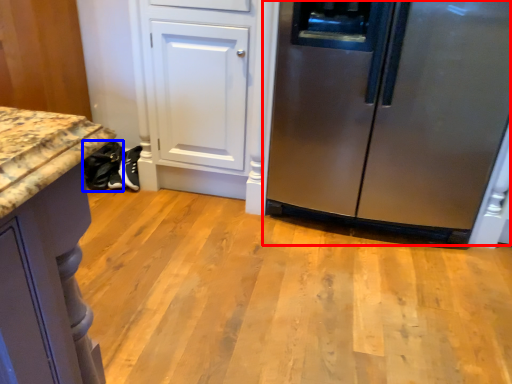
Question: Which object appears closest to the camera in this image, refrigerator (highlighted by a red box) or footwear (highlighted by a blue box)?

Choices:
 (A) refrigerator
 (B) footwear

Answer: (A)